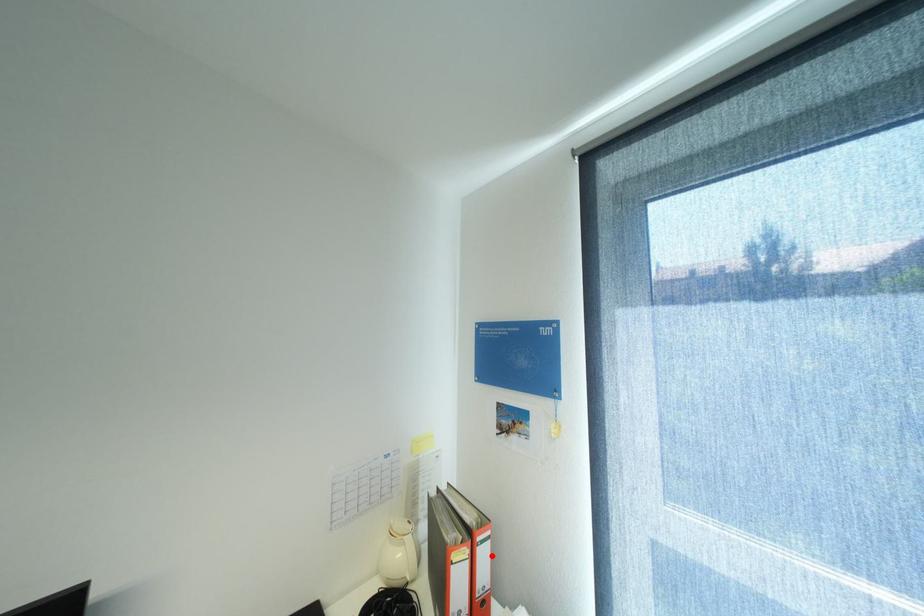
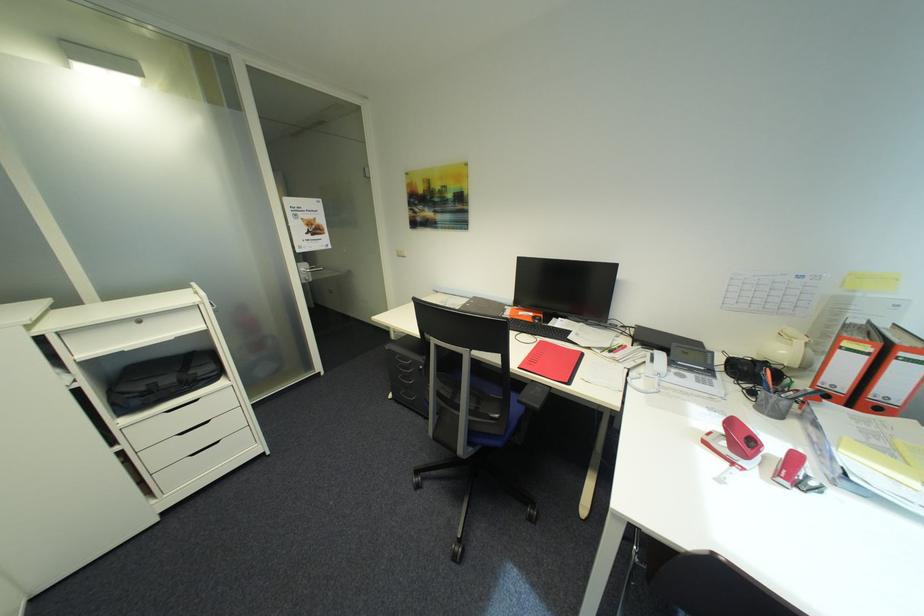
Locate, in the second image, the point that corresponds to the highlighted location in the first image.

(912, 371)